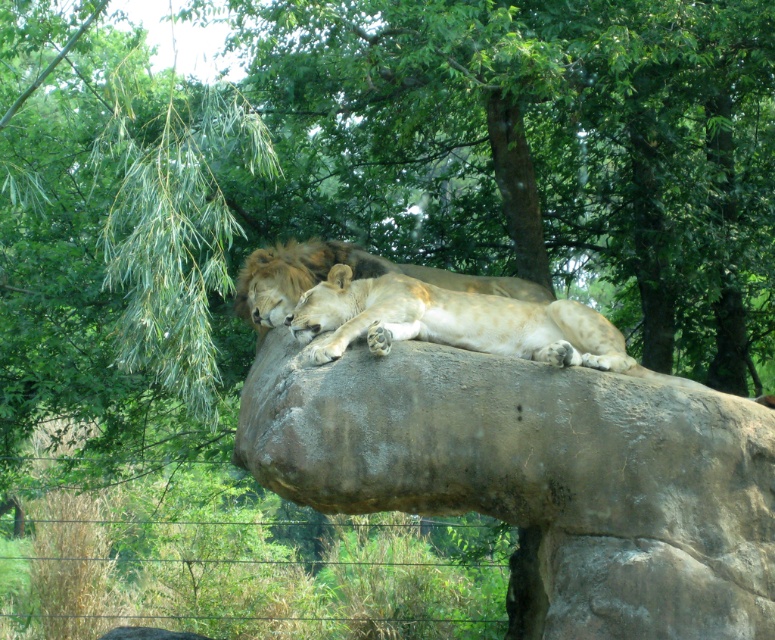
Question: Which point is farther to the camera?

Choices:
 (A) (284, 260)
 (B) (567, 477)
 (C) (474, 346)

Answer: (A)

Question: Can you confirm if brown rough rock at center is wider than golden fur lion at center?

Choices:
 (A) yes
 (B) no

Answer: (A)

Question: Which of the following is the closest to the observer?

Choices:
 (A) light brown fur at center
 (B) brown rough rock at center

Answer: (B)

Question: Does brown rough rock at center appear over light brown fur at center?

Choices:
 (A) no
 (B) yes

Answer: (A)

Question: Which of the following is the closest to the observer?

Choices:
 (A) (288, 371)
 (B) (508, 320)

Answer: (A)

Question: Is brown rough rock at center wider than light brown fur at center?

Choices:
 (A) no
 (B) yes

Answer: (B)